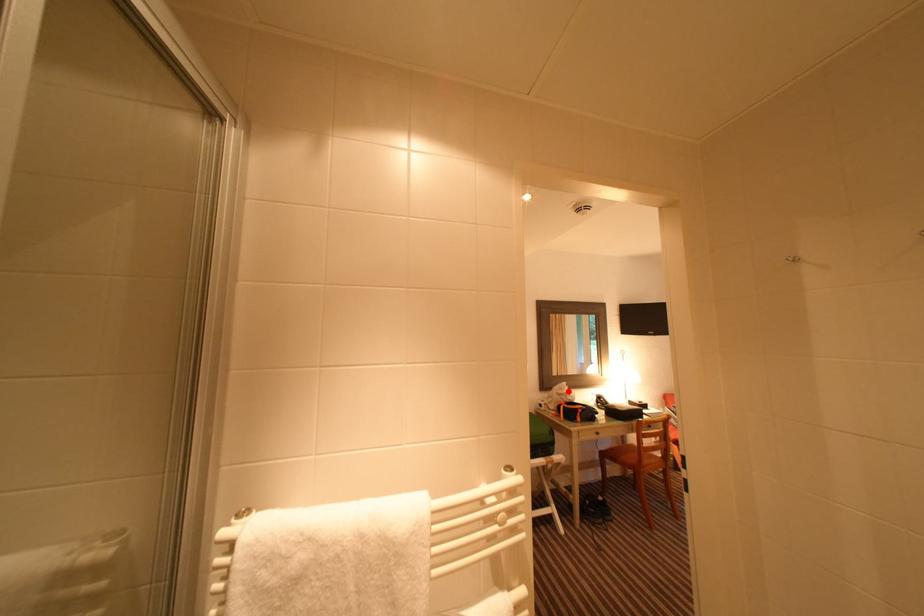
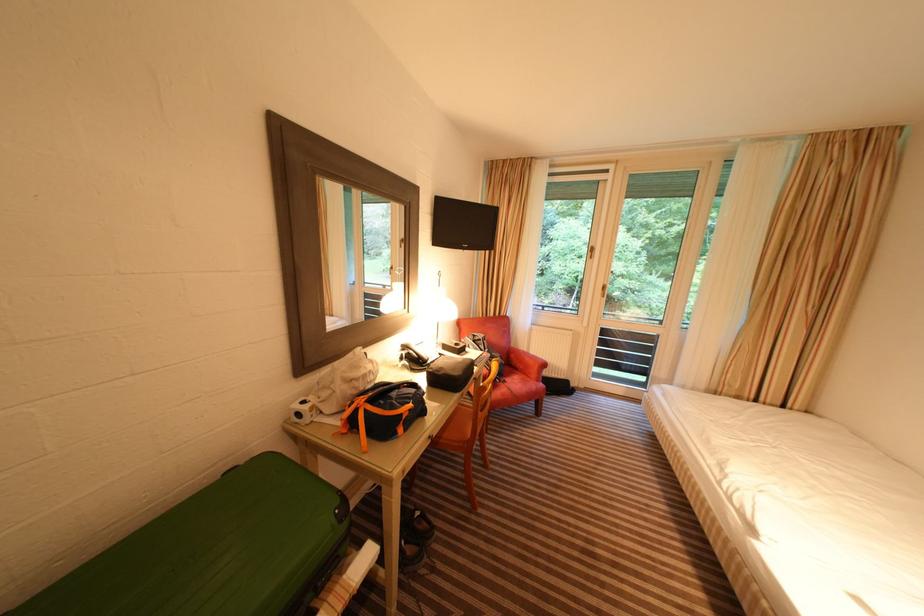
Question: I am providing you with two images of the same scene from different viewpoints. A red point is shown in image1. For the corresponding object point in image2, is it positioned nearer or farther from the camera?

Choices:
 (A) Nearer
 (B) Farther

Answer: (A)